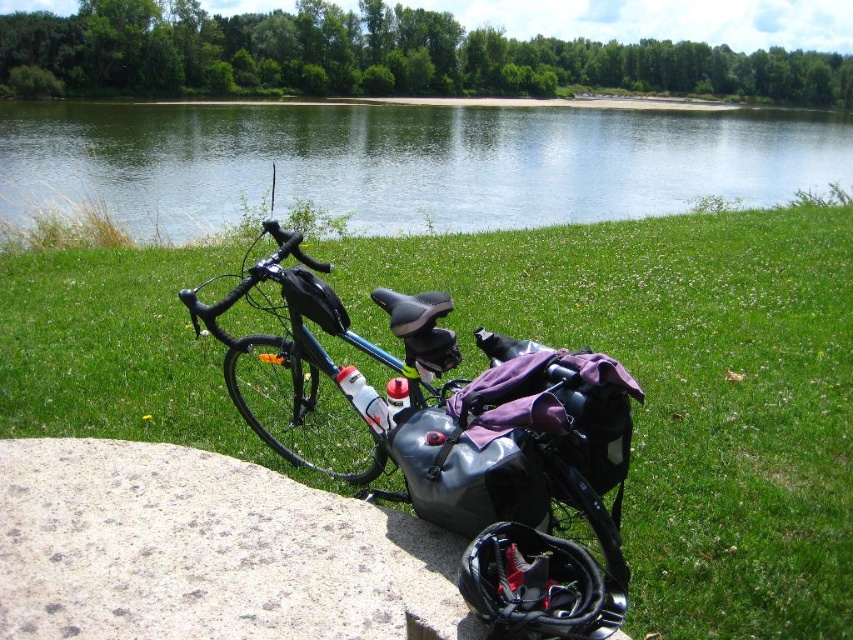
Question: Among these objects, which one is nearest to the camera?

Choices:
 (A) matte black bag at center
 (B) gray speckled stone at lower left
 (C) clear water at lake center

Answer: (B)

Question: Does clear water at lake center appear over gray speckled stone at lower left?

Choices:
 (A) no
 (B) yes

Answer: (B)

Question: Which of the following is the farthest from the observer?

Choices:
 (A) gray speckled stone at lower left
 (B) green grass at center
 (C) matte black bag at center
 (D) clear water at lake center

Answer: (D)

Question: Which of the following is the closest to the observer?

Choices:
 (A) (688, 220)
 (B) (424, 428)
 (C) (218, 573)

Answer: (C)

Question: Is green grass at center to the left of matte black bag at center from the viewer's perspective?

Choices:
 (A) yes
 (B) no

Answer: (A)

Question: Considering the relative positions of green grass at center and matte black bag at center in the image provided, where is green grass at center located with respect to matte black bag at center?

Choices:
 (A) left
 (B) right

Answer: (A)